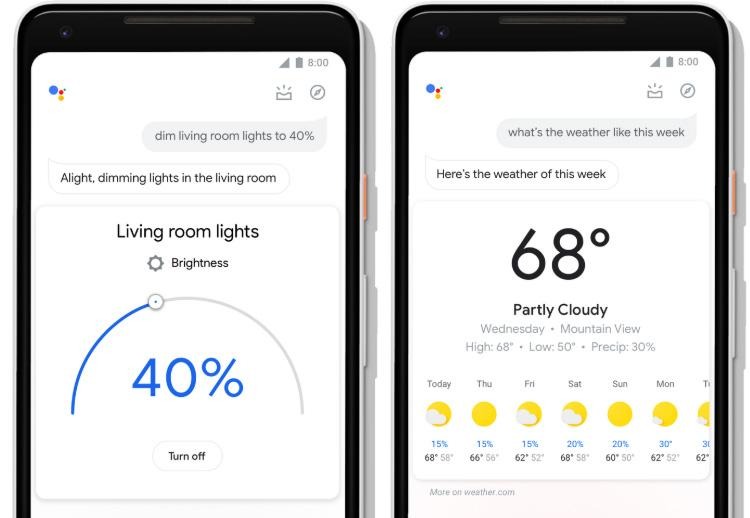
This screenshot has width=750, height=518. Find the location of `turn off button`. turn off button is located at coordinates (189, 459).